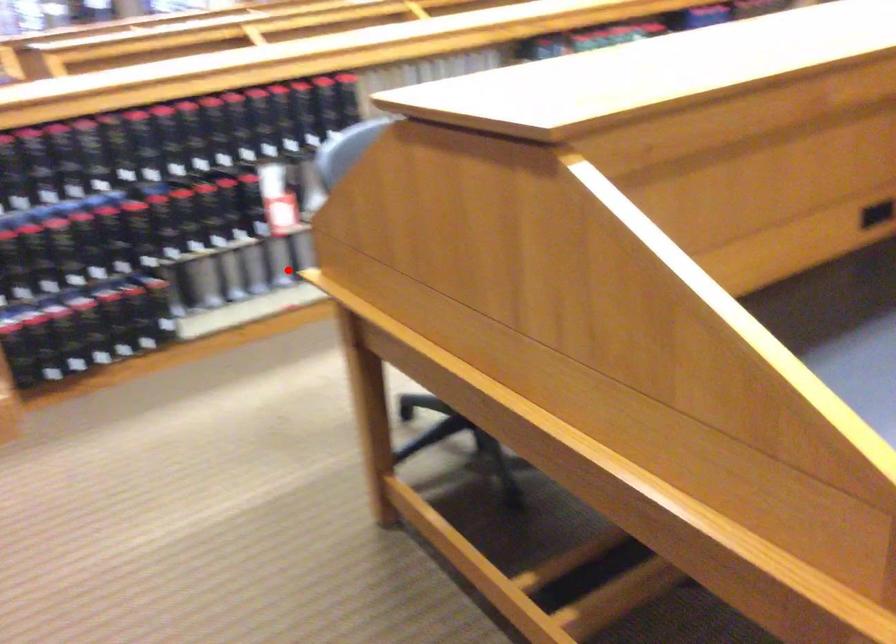
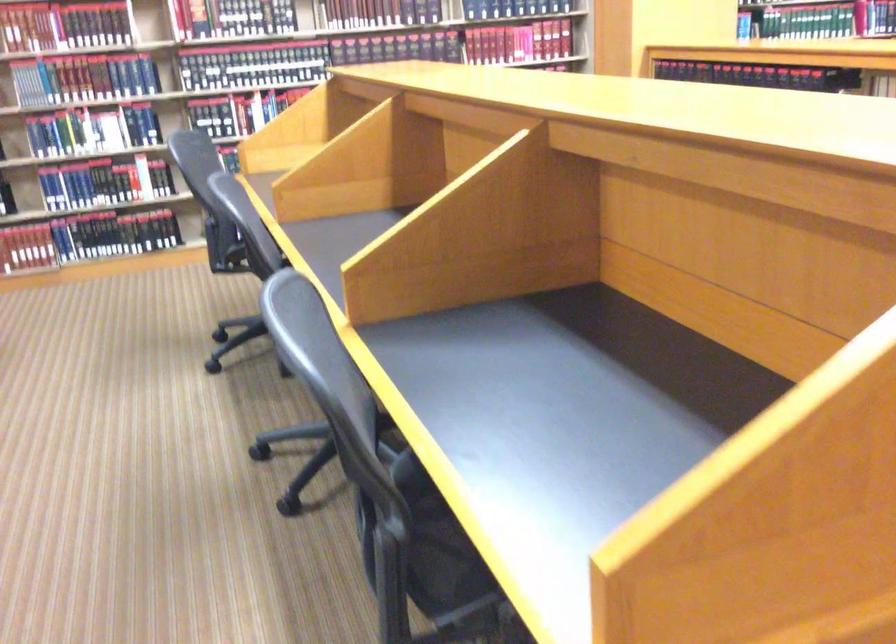
Question: I am providing you with two images of the same scene from different viewpoints. A red point is marked on the first image. At the location where the point appears in image 1, is it still visible in image 2?

Choices:
 (A) Yes
 (B) No

Answer: (B)